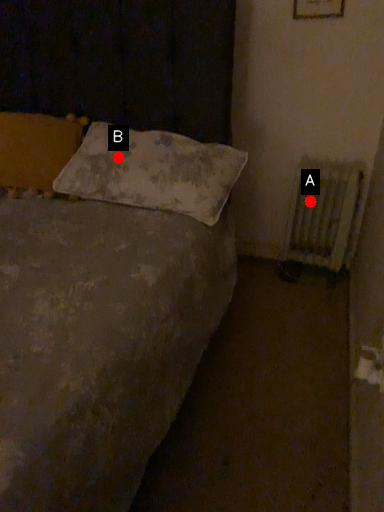
Question: Two points are circled on the image, labeled by A and B beside each circle. Which point is further to the camera?

Choices:
 (A) A is further
 (B) B is further

Answer: (A)